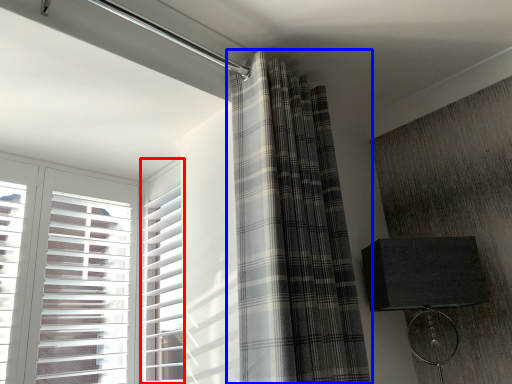
Question: Which object is closer to the camera taking this photo, window frame (highlighted by a red box) or curtain (highlighted by a blue box)?

Choices:
 (A) window frame
 (B) curtain

Answer: (B)